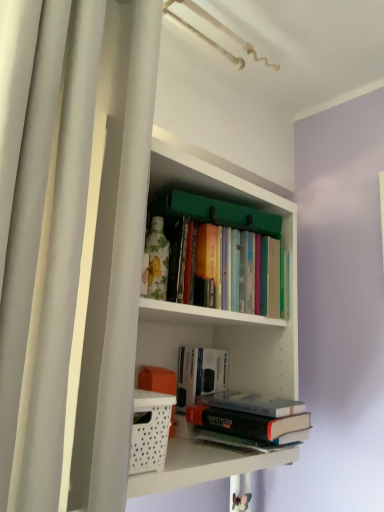
Question: Are white perforated basket at lower left and white matte bookshelf at center located far from each other?

Choices:
 (A) no
 (B) yes

Answer: (A)

Question: From the image's perspective, is white perforated basket at lower left located above white matte bookshelf at center?

Choices:
 (A) no
 (B) yes

Answer: (A)

Question: From a real-world perspective, is white perforated basket at lower left under white matte bookshelf at center?

Choices:
 (A) yes
 (B) no

Answer: (A)

Question: Is white perforated basket at lower left turned away from white matte bookshelf at center?

Choices:
 (A) no
 (B) yes

Answer: (B)

Question: Is white perforated basket at lower left wider than white matte bookshelf at center?

Choices:
 (A) no
 (B) yes

Answer: (A)

Question: Looking at their shapes, would you say hardcover books at center, the third book from the bottom, is wider or thinner than hardcover book at center, the 2th book positioned from the bottom?

Choices:
 (A) wide
 (B) thin

Answer: (A)

Question: Would you say hardcover books at center, the third book from the bottom, is to the left or to the right of hardcover book at center, arranged as the second book when viewed from the top, in the picture?

Choices:
 (A) left
 (B) right

Answer: (B)

Question: From their relative heights in the image, would you say hardcover books at center, the 1th book viewed from the top, is taller or shorter than hardcover book at center, arranged as the second book when viewed from the top?

Choices:
 (A) short
 (B) tall

Answer: (A)

Question: In terms of size, does hardcover books at center, the third book from the bottom, appear bigger or smaller than hardcover book at center, the 2th book positioned from the bottom?

Choices:
 (A) small
 (B) big

Answer: (B)

Question: From a real-world perspective, is hardcover book at center, the third book when ordered from top to bottom, above or below white matte bookshelf at center?

Choices:
 (A) below
 (B) above

Answer: (A)

Question: Is hardcover book at center, the third book when ordered from top to bottom, wider or thinner than white matte bookshelf at center?

Choices:
 (A) thin
 (B) wide

Answer: (A)

Question: From their relative heights in the image, would you say hardcover book at center, the first book ordered from the bottom, is taller or shorter than white matte bookshelf at center?

Choices:
 (A) short
 (B) tall

Answer: (A)

Question: Is point (256, 433) positioned closer to the camera than point (291, 365)?

Choices:
 (A) closer
 (B) farther

Answer: (A)

Question: Looking at the image, does hardcover books at center, the third book from the bottom, seem bigger or smaller compared to white matte bookshelf at center?

Choices:
 (A) big
 (B) small

Answer: (B)

Question: Considering the positions of hardcover books at center, the 1th book viewed from the top, and white matte bookshelf at center in the image, is hardcover books at center, the 1th book viewed from the top, taller or shorter than white matte bookshelf at center?

Choices:
 (A) short
 (B) tall

Answer: (A)